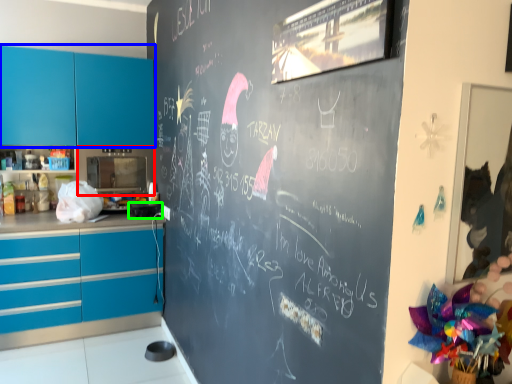
Question: Considering the real-world distances, which object is farthest from appliance (highlighted by a red box)? cabinetry (highlighted by a blue box) or appliance (highlighted by a green box)?

Choices:
 (A) cabinetry
 (B) appliance

Answer: (B)